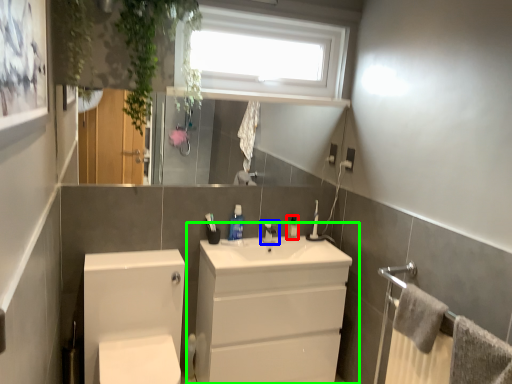
Question: Which object is the closest to the toiletry (highlighted by a red box)? Choose among these: tap (highlighted by a blue box) or bathroom cabinet (highlighted by a green box).

Choices:
 (A) tap
 (B) bathroom cabinet

Answer: (A)